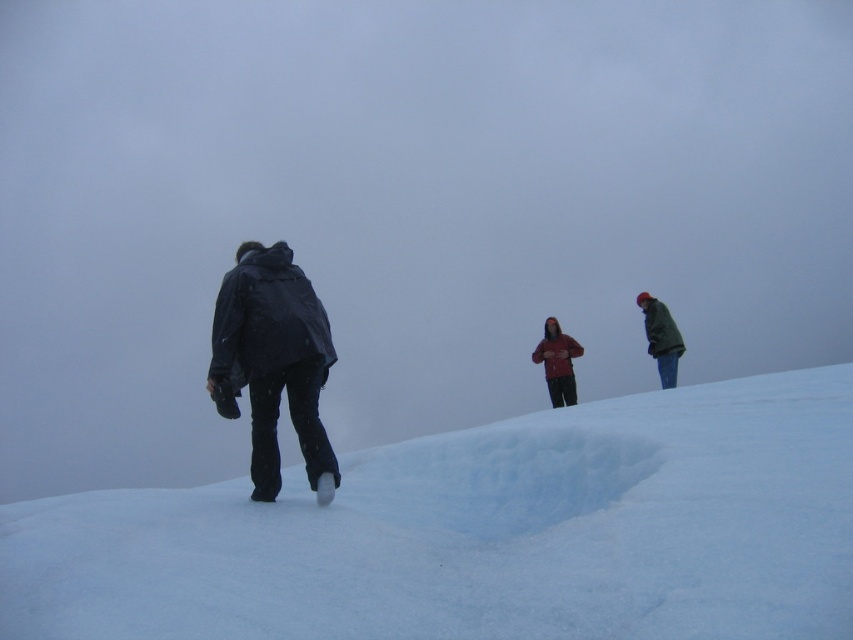
Does white fluffy snow at center have a greater height compared to matte black jacket at left?

No.

Is white fluffy snow at center positioned before matte black jacket at left?

Yes, white fluffy snow at center is closer to the viewer.

Between point (734, 381) and point (329, 352), which one is positioned in front?

Positioned in front is point (329, 352).

Identify the location of white fluffy snow at center. The image size is (853, 640). (483, 532).

Does point (776, 497) come closer to viewer compared to point (656, 326)?

Yes, point (776, 497) is closer to viewer.

Based on the photo, which of these two, white fluffy snow at center or green matte jacket at upper right, stands shorter?

With less height is white fluffy snow at center.

Is point (300, 612) positioned after point (645, 307)?

No, (300, 612) is closer to viewer.

Find the location of a particular element. The height and width of the screenshot is (640, 853). white fluffy snow at center is located at coordinates (483, 532).

Is point (248, 380) positioned after point (570, 365)?

No, (248, 380) is closer to viewer.

Can you confirm if matte black jacket at left is positioned below matte red jacket at center?

No, matte black jacket at left is not below matte red jacket at center.

Who is more distant from viewer, (252, 426) or (534, 360)?

The point (534, 360) is behind.

Where is `matte black jacket at left`? matte black jacket at left is located at coordinates (273, 362).